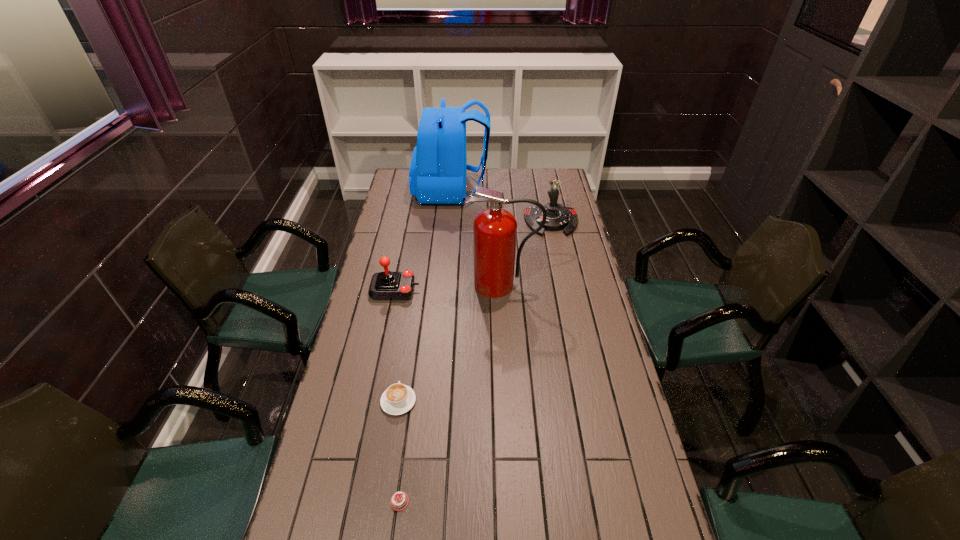
Image resolution: width=960 pixels, height=540 pixels. I want to click on free spot located on the back of the backpack, so click(x=517, y=191).

At what (x,y) coordinates should I click in order to perform the action: click on vacant area situated with the handle and nozzle on the fire extinguisher. Please return your answer as a coordinate pair (x, y). Looking at the image, I should click on (508, 366).

In order to click on vacant space located 0.220m on the handle side of the taller joystick in this screenshot , I will do `click(562, 270)`.

I want to click on vacant space located on the base of the fourth tallest object, so click(465, 289).

Locate an element on the screen. free location located on the side of the second nearest object with the handle is located at coordinates 403,370.

You are a GUI agent. You are given a task and a screenshot of the screen. Output one action in this format:
    pyautogui.click(x=<x>, y=<y>)
    Task: Click on the vacant space located on the side of the second nearest object with the handle
    The width and height of the screenshot is (960, 540).
    Given the screenshot: What is the action you would take?
    pyautogui.click(x=412, y=313)

Find the location of a particular element. This screenshot has width=960, height=540. vacant point located 0.160m on the side of the second nearest object with the handle is located at coordinates (407, 346).

Identify the location of vacant space located on the back of the chocolate cake. The width and height of the screenshot is (960, 540). (416, 375).

At what (x,y) coordinates should I click in order to perform the action: click on object positioned at the far edge. Please return your answer as a coordinate pair (x, y). Looking at the image, I should click on click(x=437, y=175).

The width and height of the screenshot is (960, 540). Identify the location of backpack at the left edge. (437, 175).